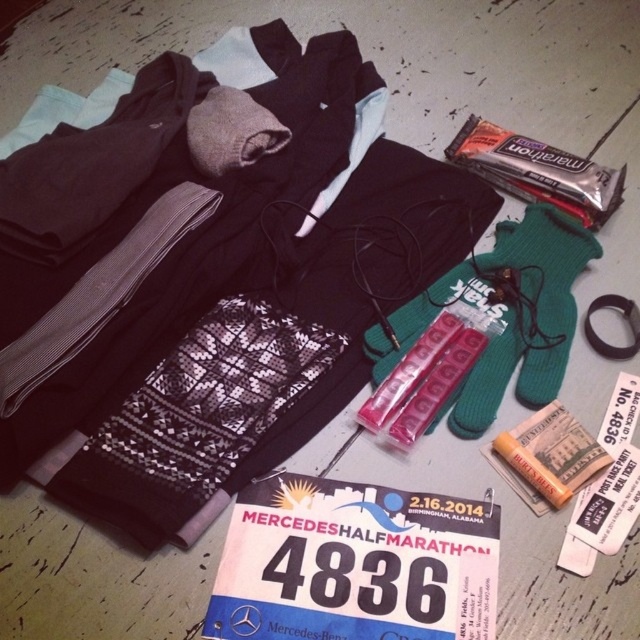
Which is more to the right, pink plastic blister pack at center or orange matte lip balm at center?

orange matte lip balm at center is more to the right.

Between pink plastic blister pack at center and orange matte lip balm at center, which one appears on the left side from the viewer's perspective?

pink plastic blister pack at center

Which is behind, point (461, 337) or point (541, 492)?

The point (461, 337) is behind.

Find the location of a particular element. pink plastic blister pack at center is located at coordinates coord(435,387).

Is pink plastic pill case at center above orange matte lip balm at center?

Yes.

Does pink plastic pill case at center have a greater height compared to orange matte lip balm at center?

Indeed, pink plastic pill case at center has a greater height compared to orange matte lip balm at center.

Which is in front, point (381, 392) or point (536, 468)?

Positioned in front is point (536, 468).

Identify the location of pink plastic pill case at center. The height and width of the screenshot is (640, 640). (410, 371).

Is pink plastic blister pack at center positioned at the back of pink plastic pill case at center?

No, it is in front of pink plastic pill case at center.

Image resolution: width=640 pixels, height=640 pixels. What do you see at coordinates (435, 387) in the screenshot?
I see `pink plastic blister pack at center` at bounding box center [435, 387].

Does point (401, 445) come behind point (432, 340)?

No, (401, 445) is in front of (432, 340).

The image size is (640, 640). What are the coordinates of `pink plastic blister pack at center` in the screenshot? It's located at (435, 387).